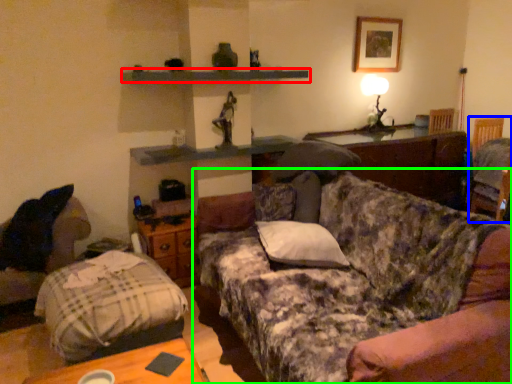
Question: Which object is positioned farthest from shelf (highlighted by a red box)? Select from swivel chair (highlighted by a blue box) and studio couch (highlighted by a green box).

Choices:
 (A) swivel chair
 (B) studio couch

Answer: (A)